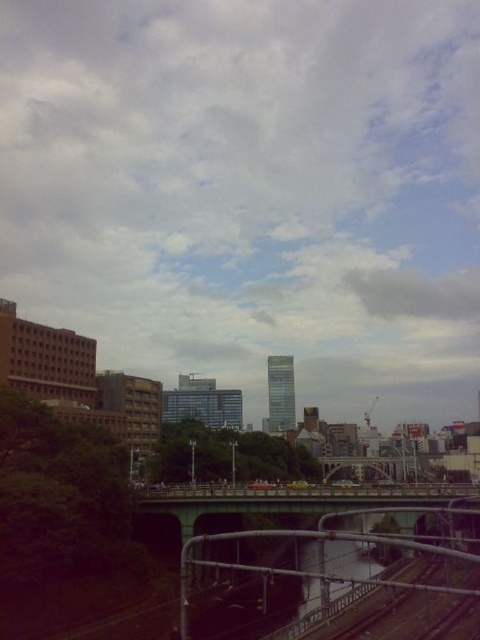
You are a delivery drone that needs to pass through the space between the green concrete bridge at center and the metallic gray bridge at center. The drone has a wingspan of 1.2 meters. Can you safely navigate through the gap between them?

The green concrete bridge at center might be wider than metallic gray bridge at center, but without specific measurements of the gap, it is uncertain if the drone can safely navigate through. Additional information about the width of the gap is needed to determine if the 1.2 meter wingspan will fit.